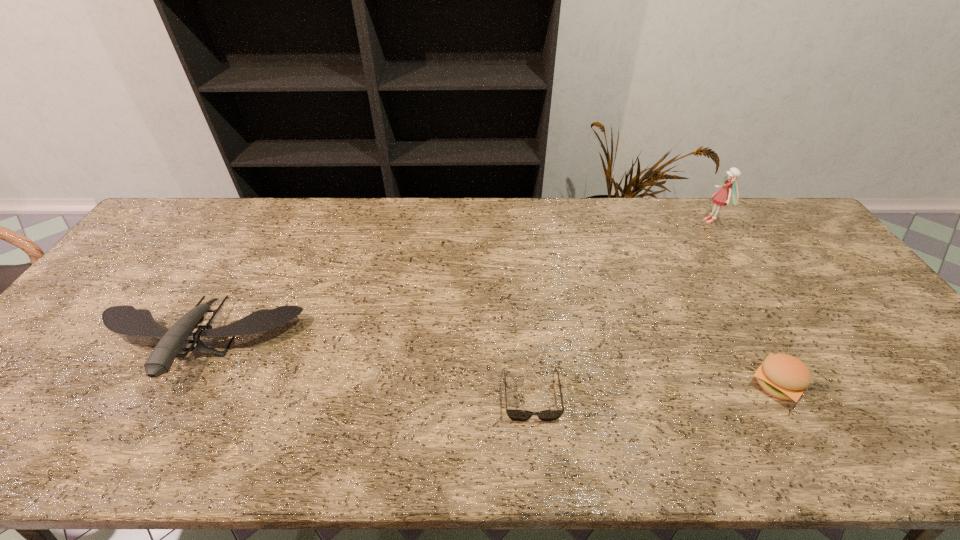
Identify the location of vacant space located at the head of the drone. The height and width of the screenshot is (540, 960). (151, 424).

Identify the location of vacant space located 0.070m on the back of the hamburger. Image resolution: width=960 pixels, height=540 pixels. (752, 338).

The width and height of the screenshot is (960, 540). I want to click on object that is at the far edge, so click(721, 197).

I want to click on object that is positioned at the left edge, so click(x=126, y=320).

Identify the location of free space at the far edge of the desktop. The height and width of the screenshot is (540, 960). (397, 237).

Where is `vacant space at the near edge of the desktop`? vacant space at the near edge of the desktop is located at coordinates (669, 446).

The height and width of the screenshot is (540, 960). In the image, there is a desktop. Find the location of `vacant space at the right edge`. vacant space at the right edge is located at coordinates (822, 279).

In order to click on free space at the far left corner of the desktop in this screenshot , I will do `click(157, 230)`.

Image resolution: width=960 pixels, height=540 pixels. In the image, there is a desktop. What are the coordinates of `vacant space at the far right corner` in the screenshot? It's located at (760, 200).

The width and height of the screenshot is (960, 540). Identify the location of unoccupied area between the drone and the third tallest object. (487, 364).